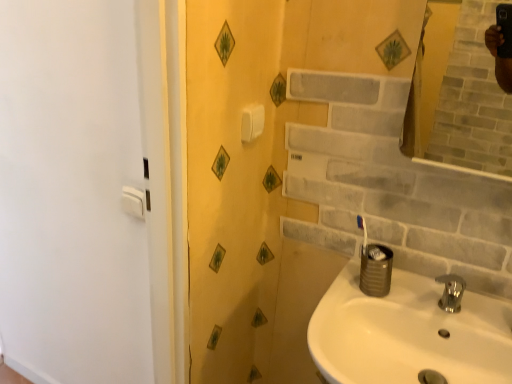
Where is `free space to the left of polished chrome faucet at lower right`? The height and width of the screenshot is (384, 512). free space to the left of polished chrome faucet at lower right is located at coordinates (381, 298).